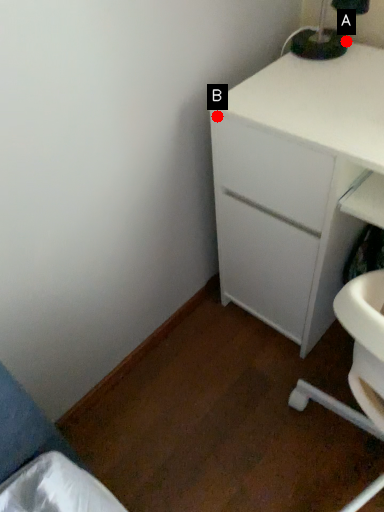
Question: Two points are circled on the image, labeled by A and B beside each circle. Which point appears closest to the camera in this image?

Choices:
 (A) A is closer
 (B) B is closer

Answer: (B)